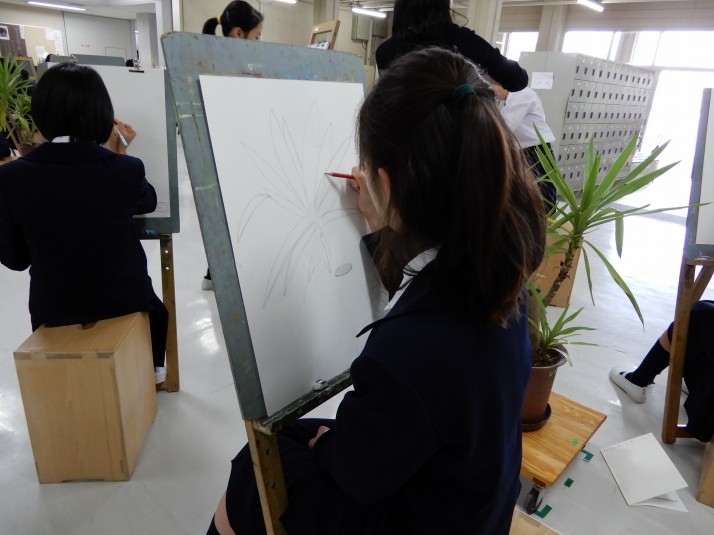
Image resolution: width=714 pixels, height=535 pixels. What are the coordinates of `windows` in the screenshot? It's located at (680, 60).